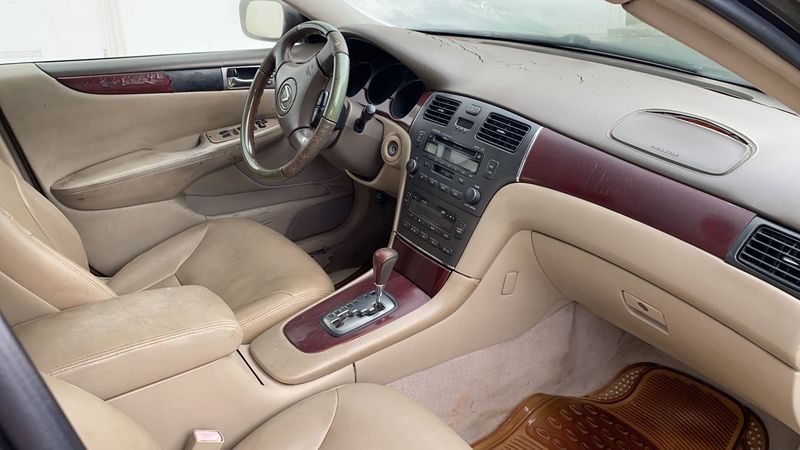
This screenshot has height=450, width=800. Find the location of `air vents`. air vents is located at coordinates 784,256, 501,132, 433,108.